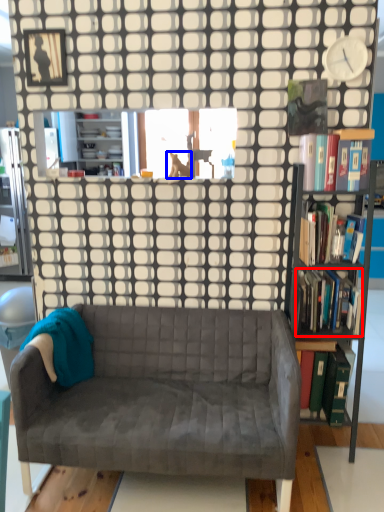
Question: Which point is closer to the camera, book (highlighted by a red box) or animal (highlighted by a blue box)?

Choices:
 (A) book
 (B) animal

Answer: (A)